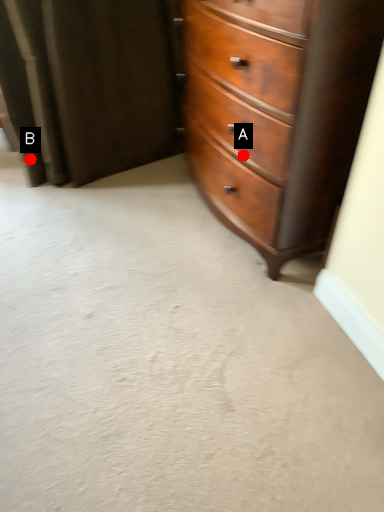
Question: Two points are circled on the image, labeled by A and B beside each circle. Which point is closer to the camera?

Choices:
 (A) A is closer
 (B) B is closer

Answer: (A)